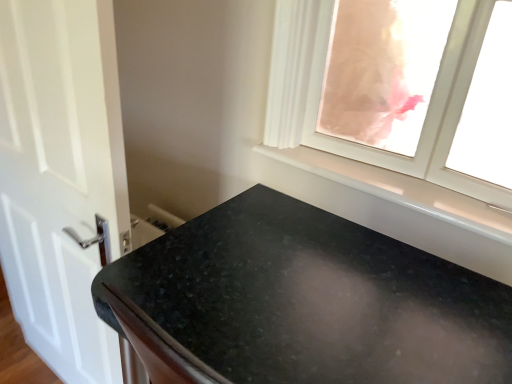
In order to face white glossy window sill at upper right, should I rotate leftwards or rightwards?

Rotate your view right by about 15.416°.

The height and width of the screenshot is (384, 512). What are the coordinates of `black granite countertop at lower center` in the screenshot? It's located at (302, 303).

Considering the positions of point (334, 259) and point (416, 180), is point (334, 259) closer or farther from the camera than point (416, 180)?

Clearly, point (334, 259) is closer to the camera than point (416, 180).

Image resolution: width=512 pixels, height=384 pixels. I want to click on countertop lying below the white glossy window sill at upper right (from the image's perspective), so click(x=302, y=303).

From the picture: From the image's perspective, between black granite countertop at lower center and white glossy window sill at upper right, who is located below?

From the image's view, black granite countertop at lower center is below.

Can you confirm if black granite countertop at lower center is taller than white glossy window sill at upper right?

Yes.

From a real-world perspective, is transparent glass window at upper right positioned under white glossy window sill at upper right based on gravity?

Actually, transparent glass window at upper right is physically above white glossy window sill at upper right in the real world.

From their relative heights in the image, would you say transparent glass window at upper right is taller or shorter than white glossy window sill at upper right?

transparent glass window at upper right is taller than white glossy window sill at upper right.

Is white glossy window sill at upper right located within transparent glass window at upper right?

No, white glossy window sill at upper right is not a part of transparent glass window at upper right.

Are white glossy window sill at upper right and white glossy door at left located far from each other?

No.

Image resolution: width=512 pixels, height=384 pixels. In order to click on window sill to the right of white glossy door at left in this screenshot , I will do `click(399, 190)`.

Does point (474, 202) come in front of point (77, 269)?

Yes, it is in front of point (77, 269).

Is white glossy window sill at upper right in front of or behind white glossy door at left in the image?

Visually, white glossy window sill at upper right is located behind white glossy door at left.

Relative to black granite countertop at lower center, is white glossy door at left in front or behind?

white glossy door at left is positioned farther from the viewer than black granite countertop at lower center.

Does white glossy door at left have a lesser width compared to black granite countertop at lower center?

Yes, white glossy door at left is thinner than black granite countertop at lower center.

Are white glossy door at left and black granite countertop at lower center located far from each other?

white glossy door at left is actually quite close to black granite countertop at lower center.

Which of these two, white glossy door at left or transparent glass window at upper right, stands taller?

With more height is white glossy door at left.

Measure the distance between white glossy door at left and transparent glass window at upper right.

They are 27.77 inches apart.

Does point (3, 182) come behind point (456, 19)?

Yes, it is.

Does white glossy door at left appear on the left side of transparent glass window at upper right?

Yes.

Is white glossy window sill at upper right in front of or behind transparent glass window at upper right in the image?

Clearly, white glossy window sill at upper right is behind transparent glass window at upper right.

Is point (330, 169) positioned after point (465, 97)?

Yes, it is.

Identify the location of window sill that appears below the transparent glass window at upper right (from a real-world perspective). The height and width of the screenshot is (384, 512). 399,190.

Between white glossy window sill at upper right and transparent glass window at upper right, which one has smaller size?

Smaller between the two is white glossy window sill at upper right.

In terms of height, does transparent glass window at upper right look taller or shorter compared to black granite countertop at lower center?

In the image, transparent glass window at upper right appears to be shorter than black granite countertop at lower center.

Does transparent glass window at upper right touch black granite countertop at lower center?

No, transparent glass window at upper right is not next to black granite countertop at lower center.

Where is `window sill that appears behind the black granite countertop at lower center`? This screenshot has width=512, height=384. window sill that appears behind the black granite countertop at lower center is located at coordinates (399, 190).

What are the coordinates of `window sill located on the left of transparent glass window at upper right` in the screenshot? It's located at (399, 190).

Considering their positions, is white glossy door at left positioned closer to transparent glass window at upper right than black granite countertop at lower center?

black granite countertop at lower center is closer to transparent glass window at upper right.

From the image, which object appears to be nearer to white glossy window sill at upper right, transparent glass window at upper right or black granite countertop at lower center?

Among the two, transparent glass window at upper right is located nearer to white glossy window sill at upper right.

Looking at the image, which one is located further to transparent glass window at upper right, black granite countertop at lower center or white glossy door at left?

white glossy door at left.

Considering their positions, is white glossy window sill at upper right positioned further to transparent glass window at upper right than black granite countertop at lower center?

black granite countertop at lower center lies further to transparent glass window at upper right than the other object.

Estimate the real-world distances between objects in this image. Which object is closer to white glossy window sill at upper right, white glossy door at left or black granite countertop at lower center?

Based on the image, black granite countertop at lower center appears to be nearer to white glossy window sill at upper right.

Considering their positions, is white glossy window sill at upper right positioned further to white glossy door at left than black granite countertop at lower center?

white glossy window sill at upper right.

Based on their spatial positions, is white glossy window sill at upper right or white glossy door at left closer to transparent glass window at upper right?

Based on the image, white glossy window sill at upper right appears to be nearer to transparent glass window at upper right.

From the image, which object appears to be nearer to white glossy door at left, transparent glass window at upper right or white glossy window sill at upper right?

white glossy window sill at upper right is closer to white glossy door at left.

You are a GUI agent. You are given a task and a screenshot of the screen. Output one action in this format:
    pyautogui.click(x=<x>, y=<y>)
    Task: Click on the countertop situated between white glossy door at left and white glossy window sill at upper right from left to right
    
    Given the screenshot: What is the action you would take?
    pyautogui.click(x=302, y=303)

This screenshot has width=512, height=384. I want to click on window sill between transparent glass window at upper right and black granite countertop at lower center from top to bottom, so click(x=399, y=190).

Where is `countertop between white glossy door at left and transparent glass window at upper right`? This screenshot has height=384, width=512. countertop between white glossy door at left and transparent glass window at upper right is located at coordinates (302, 303).

Find the location of a particular element. window sill between white glossy door at left and transparent glass window at upper right in the horizontal direction is located at coordinates (399, 190).